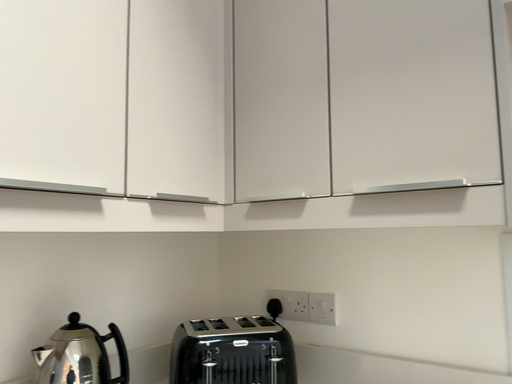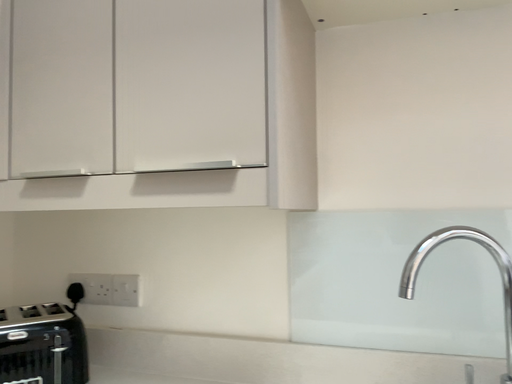
Question: Which way did the camera rotate in the video?

Choices:
 (A) rotated right
 (B) rotated left

Answer: (A)